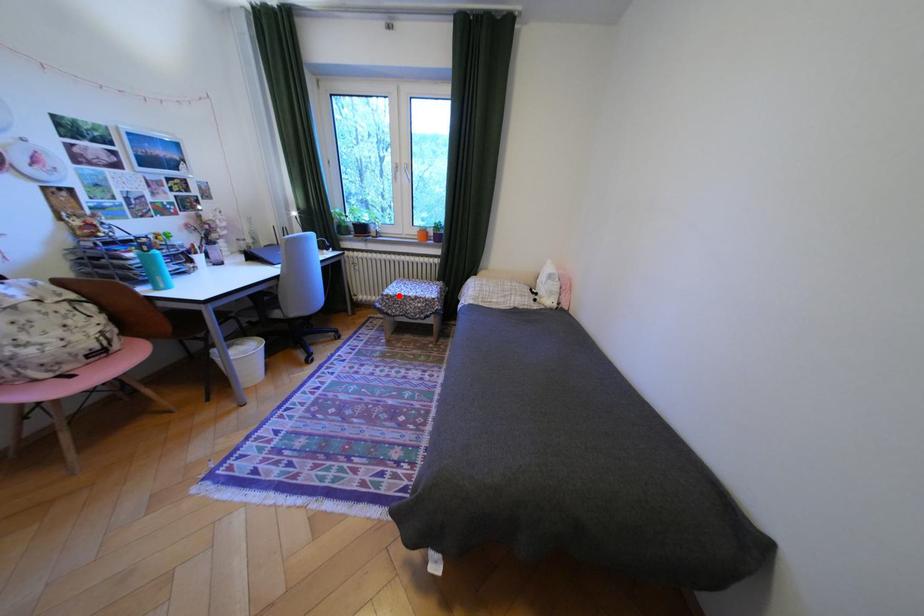
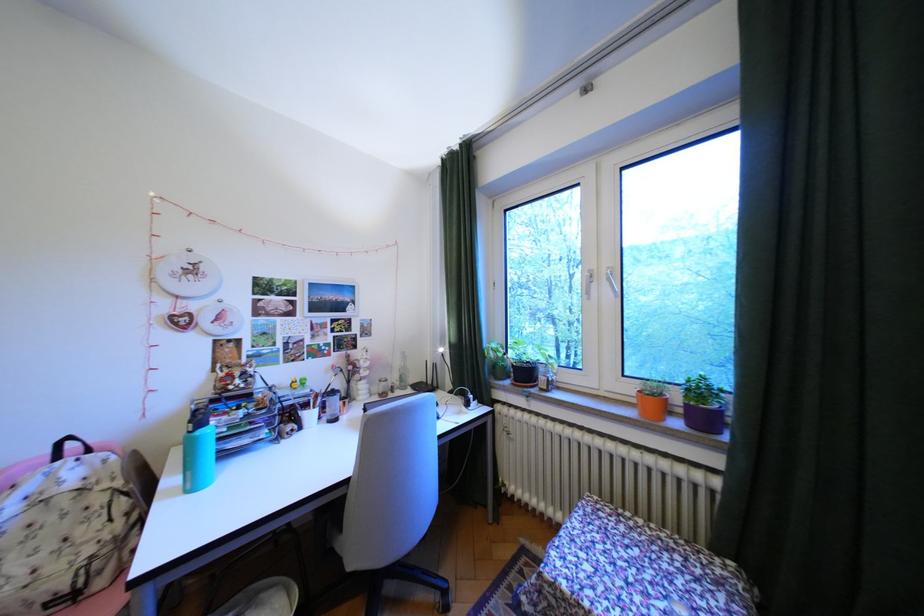
Where in the second image is the point corresponding to the highlighted location from the first image?

(564, 585)